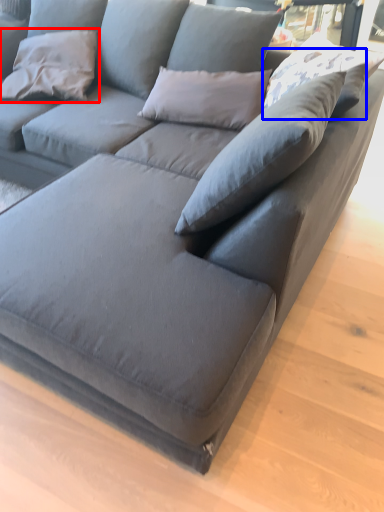
Question: Which object appears closest to the camera in this image, pillow (highlighted by a red box) or pillow (highlighted by a blue box)?

Choices:
 (A) pillow
 (B) pillow

Answer: (B)